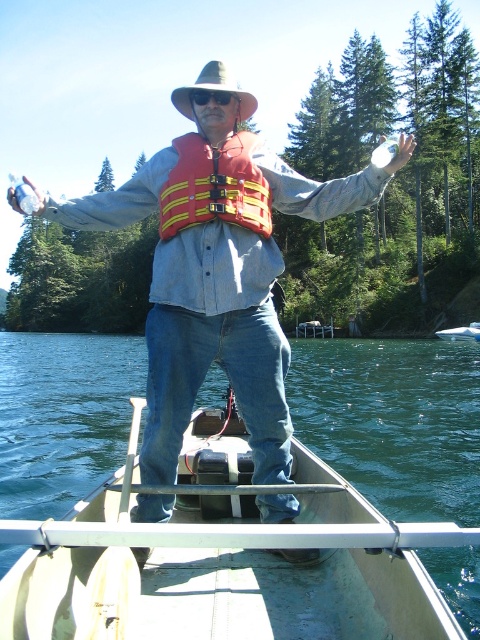
Where is the wooden canoe at center located in the image?

Result: The wooden canoe at center is located at point (225,557).

Based on the scene described, which object is smaller in size between the wooden canoe at center and the denim jeans at center?

The wooden canoe at center is smaller than the denim jeans at center according to the description.